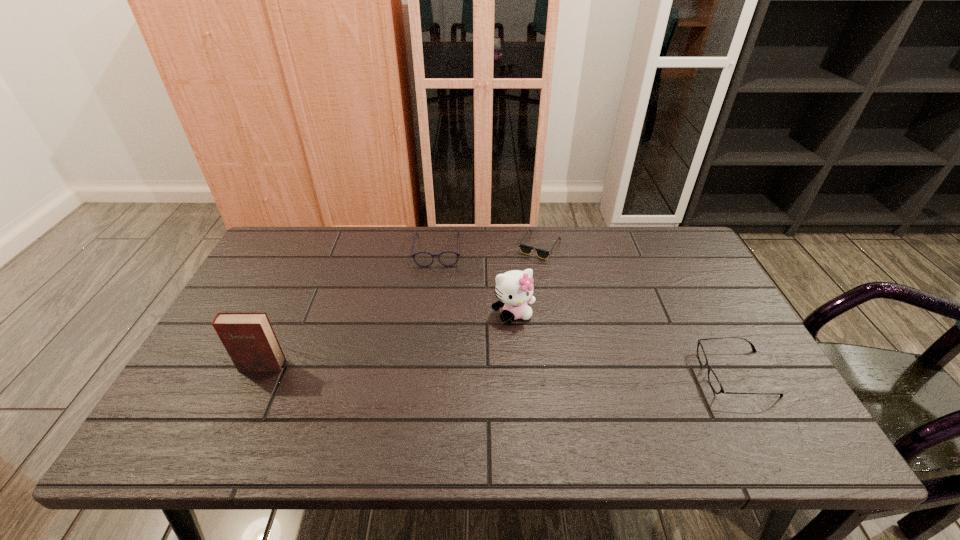
This screenshot has height=540, width=960. I want to click on vacant space that is in between the third shortest object and the right spectacles, so click(x=587, y=312).

Find the location of `object that is the second closest to the shortest object`. object that is the second closest to the shortest object is located at coordinates (447, 258).

Identify the location of object that stands as the closest to the sunglasses. The image size is (960, 540). (515, 288).

Where is `vacant space that satisfies the following two spatial constraints: 1. on the front side of the shorter spectacles; 2. on the front-facing side of the left spectacles`? This screenshot has height=540, width=960. vacant space that satisfies the following two spatial constraints: 1. on the front side of the shorter spectacles; 2. on the front-facing side of the left spectacles is located at coordinates (423, 374).